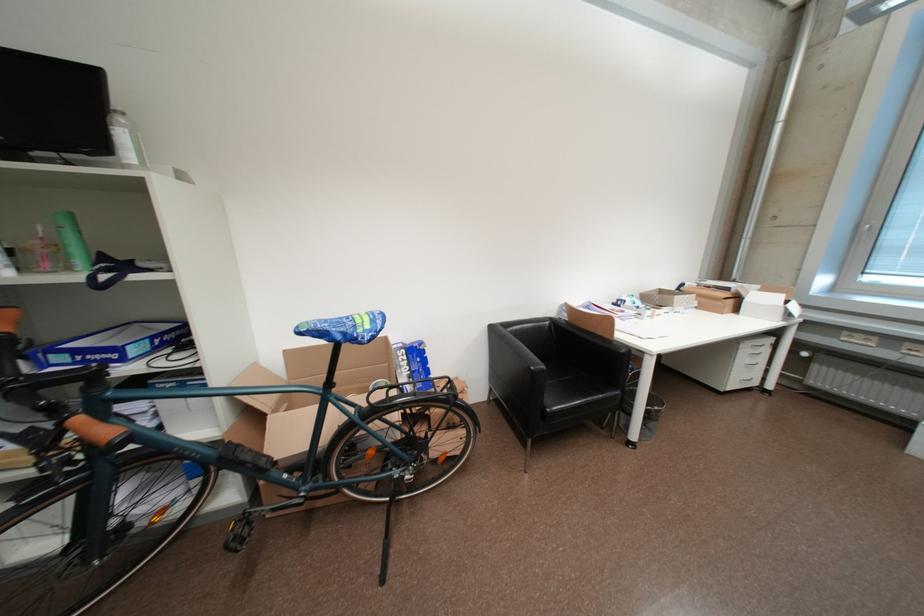
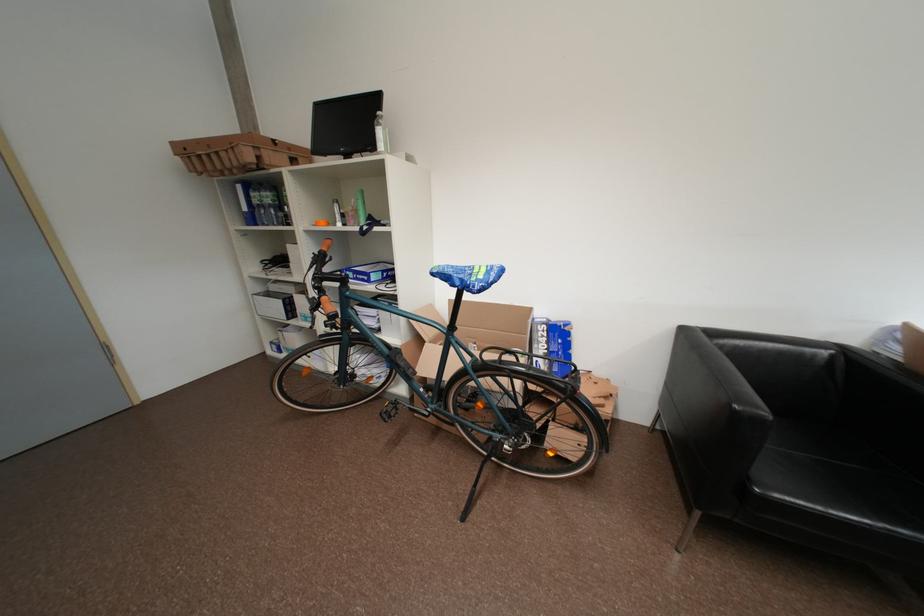
Where in the second image is the point corresponding to point (329, 505) from the first image?

(454, 429)